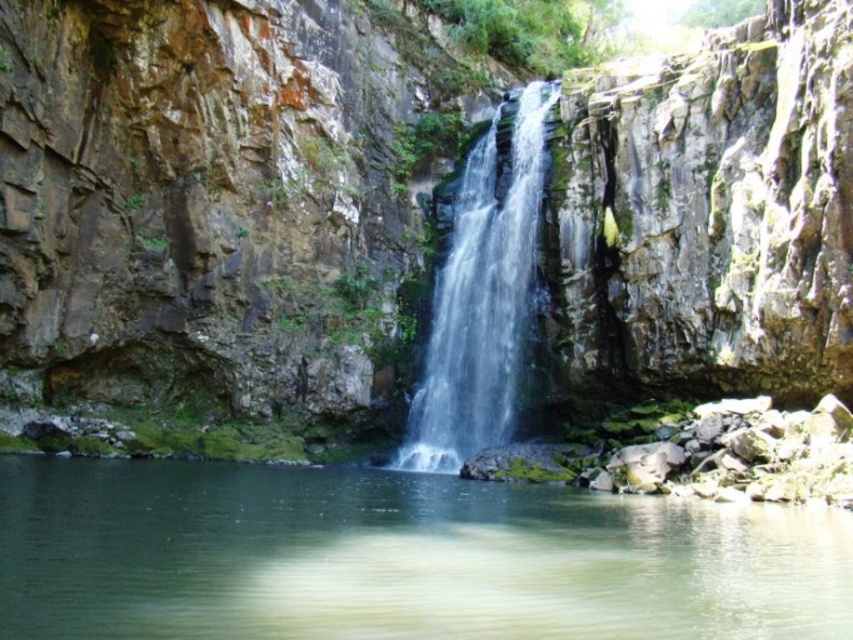
Can you confirm if green mossy rock at center is thinner than green translucent water at center?

In fact, green mossy rock at center might be wider than green translucent water at center.

Is green mossy rock at center smaller than green translucent water at center?

No, green mossy rock at center is not smaller than green translucent water at center.

Where is `green mossy rock at center`? This screenshot has width=853, height=640. green mossy rock at center is located at coordinates (207, 208).

Where is `green mossy rock at center`? This screenshot has width=853, height=640. green mossy rock at center is located at coordinates (207, 208).

Is green translucent water at center taller than clear water at center?

No, green translucent water at center is not taller than clear water at center.

Identify the location of green translucent water at center. (399, 557).

Locate an element on the screen. The width and height of the screenshot is (853, 640). green translucent water at center is located at coordinates (399, 557).

Who is more forward, (651, 241) or (434, 310)?

Point (651, 241)

Does green mossy rock at center have a smaller size compared to clear water at center?

No, green mossy rock at center is not smaller than clear water at center.

Is point (291, 259) farther from camera compared to point (466, 428)?

That is True.

Locate an element on the screen. This screenshot has height=640, width=853. green mossy rock at center is located at coordinates (207, 208).